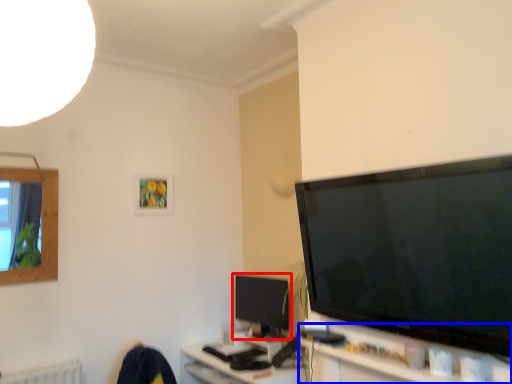
Question: Which point is further to the camera, television (highlighted by a red box) or tv cabinet (highlighted by a blue box)?

Choices:
 (A) television
 (B) tv cabinet

Answer: (A)